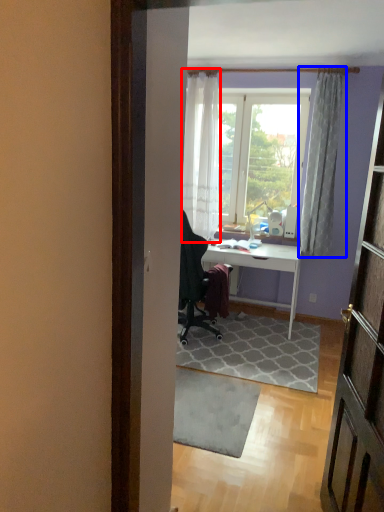
Question: Which of the following is the farthest to the observer, curtain (highlighted by a red box) or curtain (highlighted by a blue box)?

Choices:
 (A) curtain
 (B) curtain

Answer: (A)